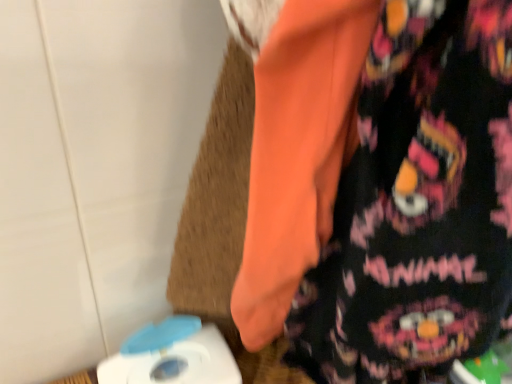
Locate an element on the screen. This screenshot has height=384, width=512. white plastic toy at lower left is located at coordinates (172, 355).

The height and width of the screenshot is (384, 512). What do you see at coordinates (172, 355) in the screenshot?
I see `white plastic toy at lower left` at bounding box center [172, 355].

The height and width of the screenshot is (384, 512). Identify the location of white plastic toy at lower left. (172, 355).